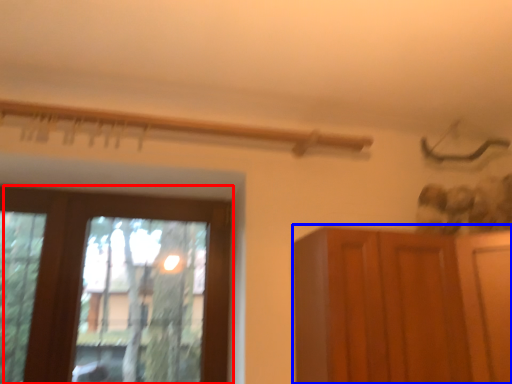
Question: Which of the following is the closest to the observer, window (highlighted by a red box) or cupboard (highlighted by a blue box)?

Choices:
 (A) window
 (B) cupboard

Answer: (B)